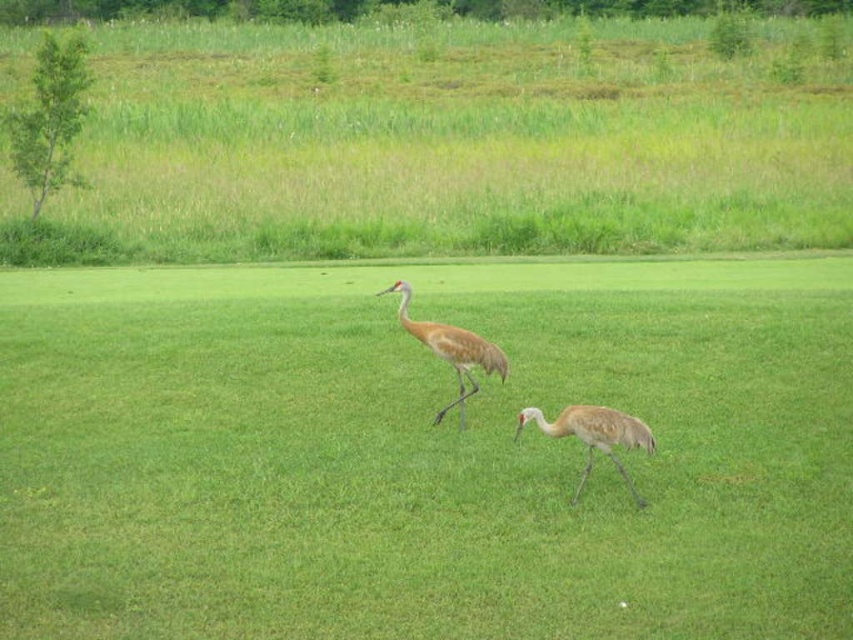
Does green grass at center have a lesser height compared to brown feathered crane at center?

No.

Who is more distant from viewer, (796, 628) or (438, 346)?

The point (438, 346) is behind.

Identify the location of green grass at center. (422, 454).

Who is lower down, green grass at center or green grass at upper left?

green grass at center is below.

Is point (171, 269) in front of point (659, 248)?

Yes, point (171, 269) is closer to viewer.

You are a GUI agent. You are given a task and a screenshot of the screen. Output one action in this format:
    pyautogui.click(x=<x>, y=<y>)
    Task: Click on the green grass at center
    Image resolution: width=853 pixels, height=640 pixels.
    Given the screenshot: What is the action you would take?
    pyautogui.click(x=422, y=454)

Can you confirm if green grass at upper left is smaller than light brown feathered bird at center?

Actually, green grass at upper left might be larger than light brown feathered bird at center.

Does green grass at upper left lie in front of light brown feathered bird at center?

No.

Which is behind, point (294, 52) or point (611, 452)?

Point (294, 52)

Find the location of a particular element. The image size is (853, 640). green grass at upper left is located at coordinates (463, 140).